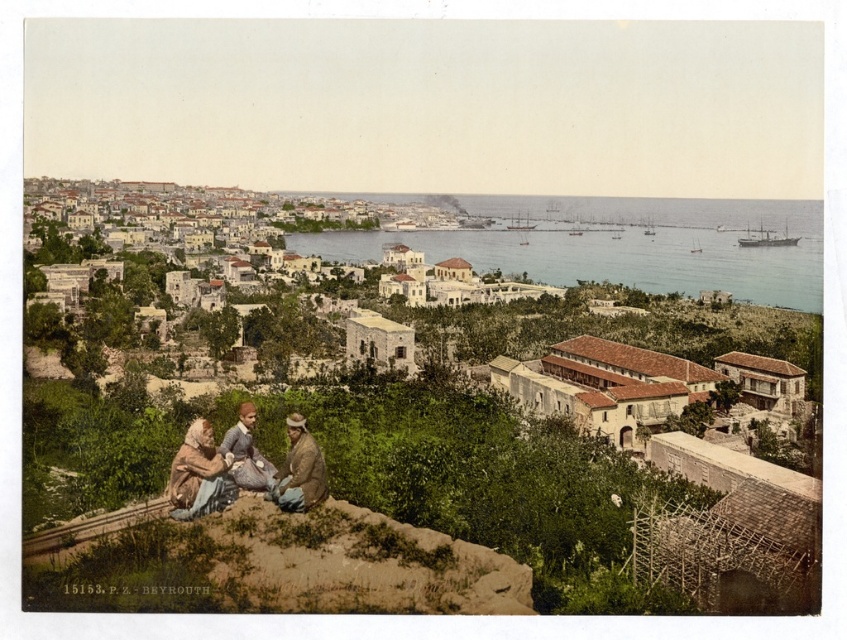
You are a photographer standing at the edge of the rocky outcrop where the three individuals are seated. You want to capture a photo of the light beige stone buildings at center. Based on their position, will they be in the center of your photo if you frame the shot using the rule of thirds?

The light beige stone buildings at center are located at coordinates approximately (435,300), which aligns with the center of the image. Since the rule of thirds divides the frame into nine equal parts, the center position would place them in the central intersection point, making them the focal point of the photo.

You are a photographer in the late 19th century taking a picture of two women in dresses. The women are sitting on a rocky outcrop in a coastal town. You need to ensure the matte brown dress at lower center and the matte blue dress at lower left are positioned correctly. According to the scene description, which dress is positioned to the right of the other?

→ The matte brown dress at lower center is positioned to the right of the matte blue dress at lower left.